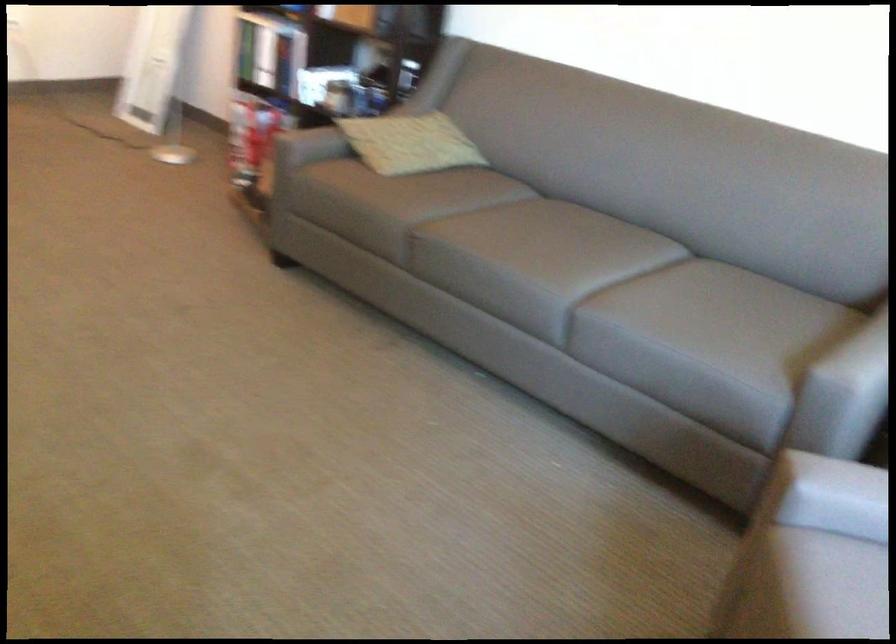
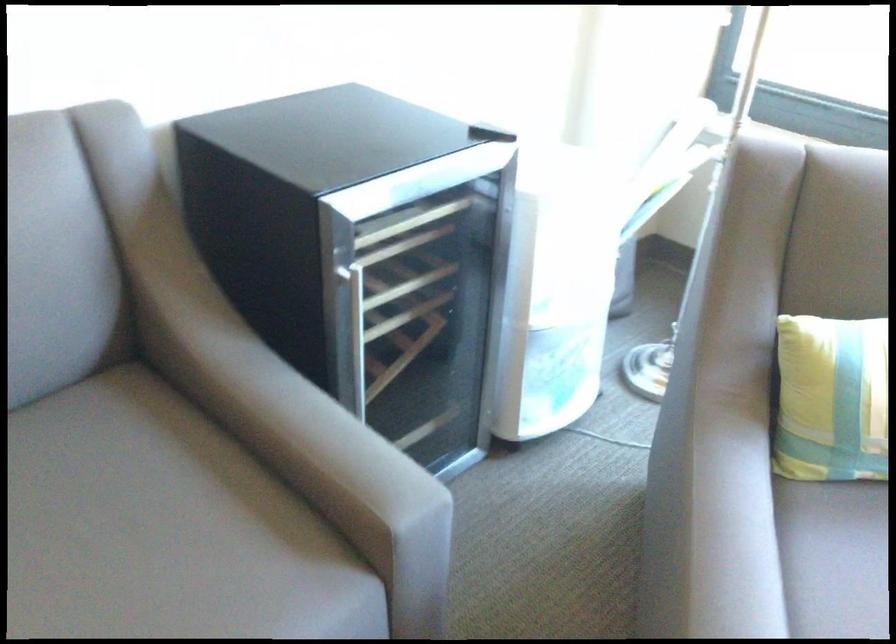
In the second image, find the point that corresponds to point (652, 283) in the first image.

(83, 529)